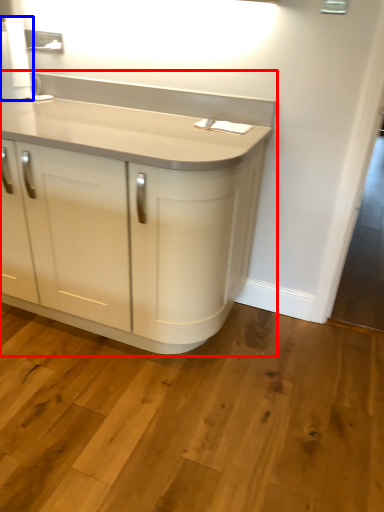
Question: Which point is closer to the camera, cupboard (highlighted by a red box) or paper towel (highlighted by a blue box)?

Choices:
 (A) cupboard
 (B) paper towel

Answer: (A)